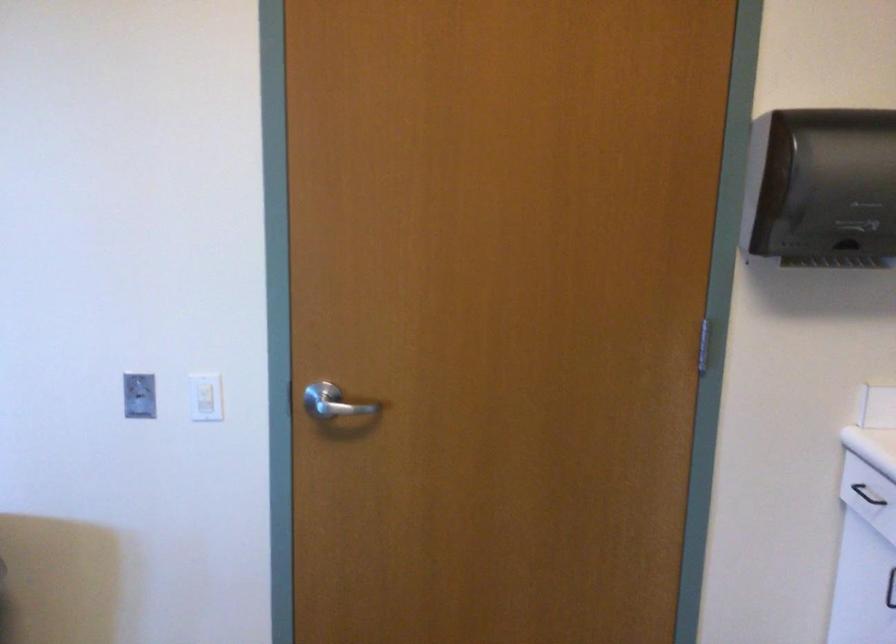
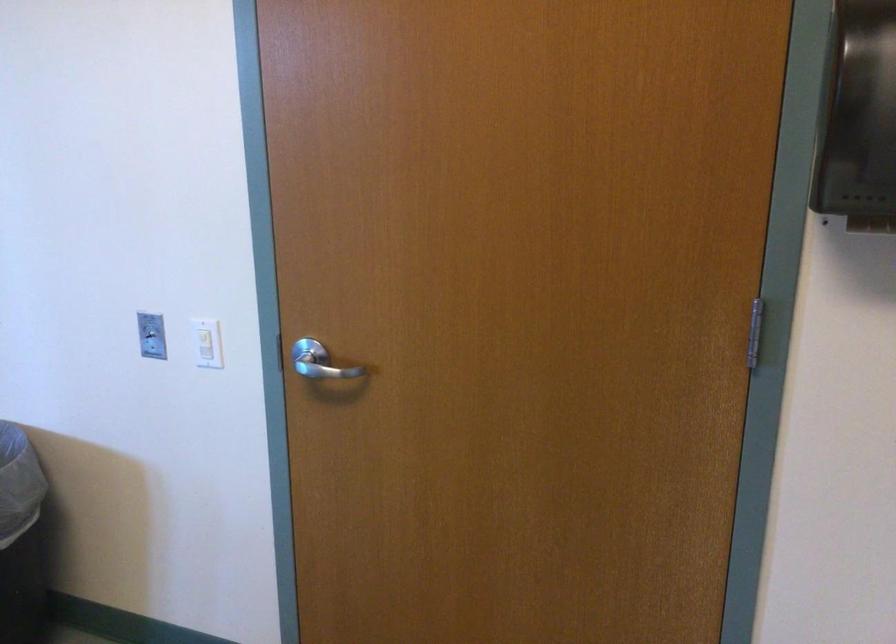
Find the pixel in the second image that matches point 330,404 in the first image.

(319, 362)